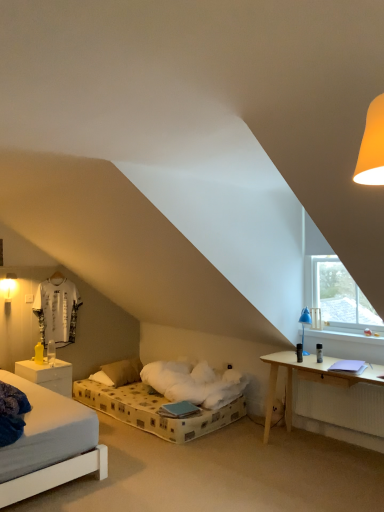
Question: Is matte white wall sconce at left positioned before white matte nightstand at lower left?

Choices:
 (A) no
 (B) yes

Answer: (A)

Question: Can you confirm if matte white wall sconce at left is positioned to the left of white matte nightstand at lower left?

Choices:
 (A) no
 (B) yes

Answer: (B)

Question: Does matte white wall sconce at left have a lesser width compared to white matte nightstand at lower left?

Choices:
 (A) no
 (B) yes

Answer: (B)

Question: Is matte white wall sconce at left positioned with its back to white matte nightstand at lower left?

Choices:
 (A) yes
 (B) no

Answer: (B)

Question: Does matte white wall sconce at left have a larger size compared to white matte nightstand at lower left?

Choices:
 (A) no
 (B) yes

Answer: (A)

Question: From the image's perspective, is white matte nightstand at lower left located above or below transparent glass window at upper right?

Choices:
 (A) above
 (B) below

Answer: (B)

Question: In terms of width, does white matte nightstand at lower left look wider or thinner when compared to transparent glass window at upper right?

Choices:
 (A) thin
 (B) wide

Answer: (B)

Question: Is white matte nightstand at lower left spatially inside transparent glass window at upper right, or outside of it?

Choices:
 (A) inside
 (B) outside

Answer: (B)

Question: Considering the relative positions of white matte nightstand at lower left and transparent glass window at upper right in the image provided, is white matte nightstand at lower left to the left or to the right of transparent glass window at upper right?

Choices:
 (A) right
 (B) left

Answer: (B)

Question: Based on their positions, is matte white wall sconce at left located to the left or right of blue plastic table lamp at right?

Choices:
 (A) right
 (B) left

Answer: (B)

Question: Considering their positions, is matte white wall sconce at left located in front of or behind blue plastic table lamp at right?

Choices:
 (A) behind
 (B) front

Answer: (A)

Question: Considering the positions of matte white wall sconce at left and blue plastic table lamp at right in the image, is matte white wall sconce at left bigger or smaller than blue plastic table lamp at right?

Choices:
 (A) small
 (B) big

Answer: (A)

Question: Would you say matte white wall sconce at left is inside or outside blue plastic table lamp at right?

Choices:
 (A) inside
 (B) outside

Answer: (B)

Question: Considering the positions of transparent glass window at upper right and white matte nightstand at lower left in the image, is transparent glass window at upper right taller or shorter than white matte nightstand at lower left?

Choices:
 (A) short
 (B) tall

Answer: (B)

Question: In terms of size, does transparent glass window at upper right appear bigger or smaller than white matte nightstand at lower left?

Choices:
 (A) big
 (B) small

Answer: (B)